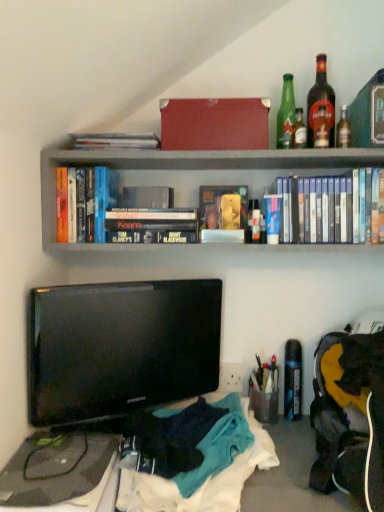
Question: From the image's perspective, is black glossy tv at lower left positioned above or below hardcover books at upper center?

Choices:
 (A) below
 (B) above

Answer: (A)

Question: Is black glossy tv at lower left spatially inside hardcover books at upper center, or outside of it?

Choices:
 (A) outside
 (B) inside

Answer: (A)

Question: Considering the real-world distances, which object is closest to the hardcover book at upper right, the 1th paperback book viewed from the right?

Choices:
 (A) hardcover book at upper center, which is counted as the fourth paperback book, starting from the right
 (B) black matte dvd case at upper center, marked as the third book in a left-to-right arrangement
 (C) green glass bottle at upper right, which is counted as the third bottle, starting from the right
 (D) hardcover books at upper center
 (E) blue matte book at center, the 2th paperback book in the right-to-left sequence

Answer: (C)

Question: Considering the real-world distances, which object is farthest from the hardcover book at upper right, which ranks as the fourth paperback book in left-to-right order?

Choices:
 (A) hardcover book at upper left, which is the first book in left-to-right order
 (B) green glass bottle at upper right, placed as the 1th bottle when sorted from right to left
 (C) hardcover book at upper center, the second book viewed from the left
 (D) knitted wool sweater at lower center
 (E) hardcover book at center, the 2th paperback book when ordered from left to right

Answer: (D)